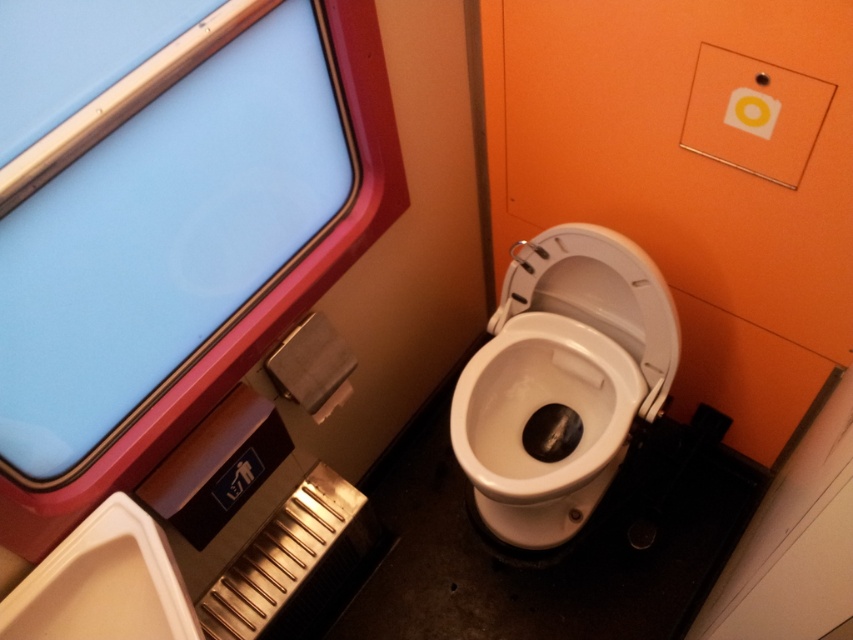
Question: Is blue glass window at upper left above white glossy toilet bowl at center?

Choices:
 (A) yes
 (B) no

Answer: (A)

Question: From the image, what is the correct spatial relationship of blue glass window at upper left in relation to white glossy toilet bowl at center?

Choices:
 (A) below
 (B) above

Answer: (B)

Question: Is the position of blue glass window at upper left more distant than that of white glossy toilet bowl at center?

Choices:
 (A) no
 (B) yes

Answer: (A)

Question: Which point is closer to the camera?

Choices:
 (A) blue glass window at upper left
 (B) white glossy toilet bowl at center

Answer: (A)